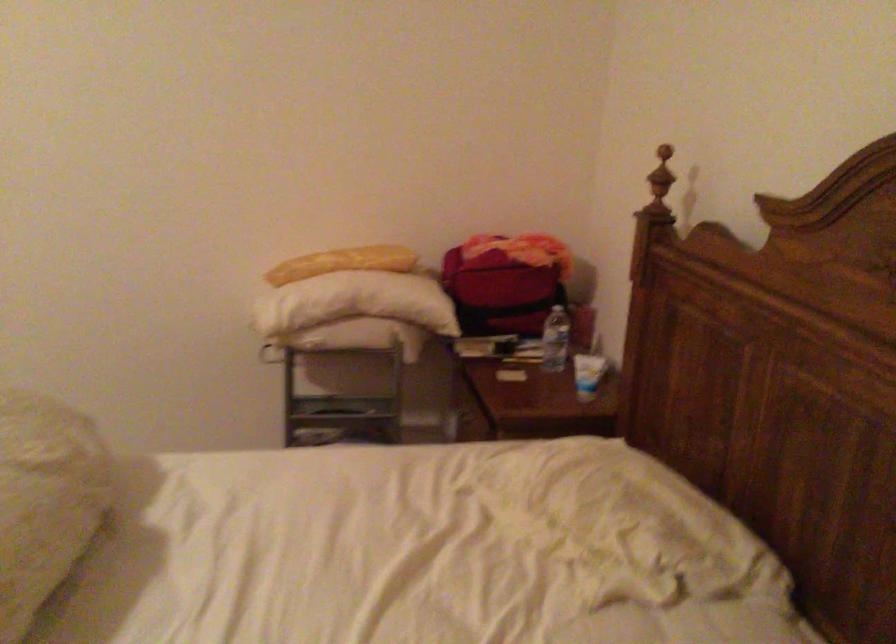
Identify the location of red bag. (504, 281).